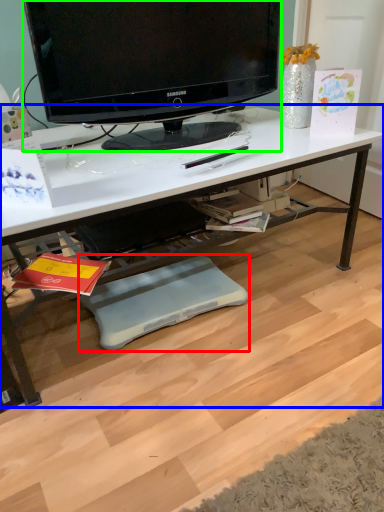
Question: Estimate the real-world distances between objects in this image. Which object is closer to footrest (highlighted by a red box), desk (highlighted by a blue box) or television (highlighted by a green box)?

Choices:
 (A) desk
 (B) television

Answer: (A)